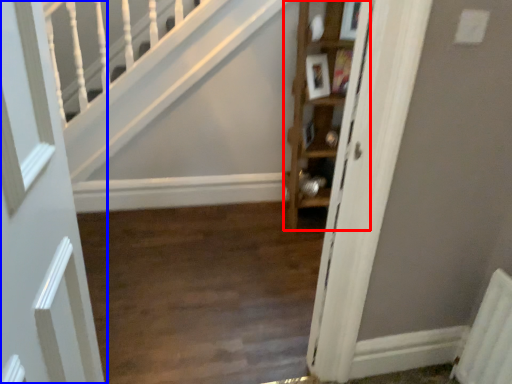
Question: Which point is closer to the camera, cabinet (highlighted by a red box) or door (highlighted by a blue box)?

Choices:
 (A) cabinet
 (B) door

Answer: (B)